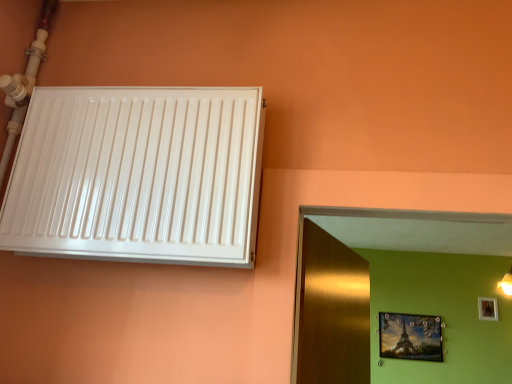
Question: Should I look upward or downward to see metallic gold picture frame at upper right, the 1th picture frame in the left-to-right sequence?

Choices:
 (A) down
 (B) up

Answer: (A)

Question: Can you confirm if wooden photo frame at upper right, which is the 1th picture frame from right to left, is taller than white glossy radiator at upper left?

Choices:
 (A) yes
 (B) no

Answer: (B)

Question: From a real-world perspective, is wooden photo frame at upper right, the 2th picture frame from the bottom, physically above white glossy radiator at upper left?

Choices:
 (A) no
 (B) yes

Answer: (B)

Question: Is wooden photo frame at upper right, placed as the first picture frame when sorted from top to bottom, positioned before white glossy radiator at upper left?

Choices:
 (A) no
 (B) yes

Answer: (A)

Question: Is wooden photo frame at upper right, the 2th picture frame from the bottom, aimed at white glossy radiator at upper left?

Choices:
 (A) yes
 (B) no

Answer: (B)

Question: Is wooden photo frame at upper right, placed as the first picture frame when sorted from top to bottom, oriented away from white glossy radiator at upper left?

Choices:
 (A) yes
 (B) no

Answer: (B)

Question: Are wooden photo frame at upper right, placed as the first picture frame when sorted from top to bottom, and white glossy radiator at upper left far apart?

Choices:
 (A) yes
 (B) no

Answer: (A)

Question: Is wooden photo frame at upper right, which is the 1th picture frame from right to left, turned away from metallic gold picture frame at upper right, arranged as the first picture frame when ordered from the bottom?

Choices:
 (A) yes
 (B) no

Answer: (B)

Question: Can you confirm if wooden photo frame at upper right, positioned as the second picture frame in left-to-right order, is bigger than metallic gold picture frame at upper right, the second picture frame from the top?

Choices:
 (A) no
 (B) yes

Answer: (A)

Question: Would you consider wooden photo frame at upper right, which is the 1th picture frame from right to left, to be distant from metallic gold picture frame at upper right, arranged as the first picture frame when ordered from the bottom?

Choices:
 (A) yes
 (B) no

Answer: (B)

Question: Considering the relative sizes of wooden photo frame at upper right, which is the 1th picture frame from right to left, and metallic gold picture frame at upper right, the second picture frame positioned from the right, in the image provided, is wooden photo frame at upper right, which is the 1th picture frame from right to left, thinner than metallic gold picture frame at upper right, the second picture frame positioned from the right,?

Choices:
 (A) yes
 (B) no

Answer: (A)

Question: From the image's perspective, does wooden photo frame at upper right, the 2th picture frame from the bottom, appear lower than metallic gold picture frame at upper right, arranged as the first picture frame when ordered from the bottom?

Choices:
 (A) yes
 (B) no

Answer: (B)

Question: From the image's perspective, is wooden photo frame at upper right, placed as the first picture frame when sorted from top to bottom, on metallic gold picture frame at upper right, the 1th picture frame in the left-to-right sequence?

Choices:
 (A) yes
 (B) no

Answer: (A)

Question: From a real-world perspective, is white glossy radiator at upper left on wooden photo frame at upper right, positioned as the second picture frame in left-to-right order?

Choices:
 (A) yes
 (B) no

Answer: (B)